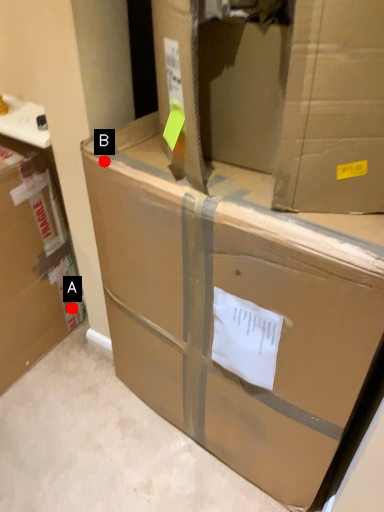
Question: Two points are circled on the image, labeled by A and B beside each circle. Among these points, which one is farthest from the camera?

Choices:
 (A) A is further
 (B) B is further

Answer: (A)